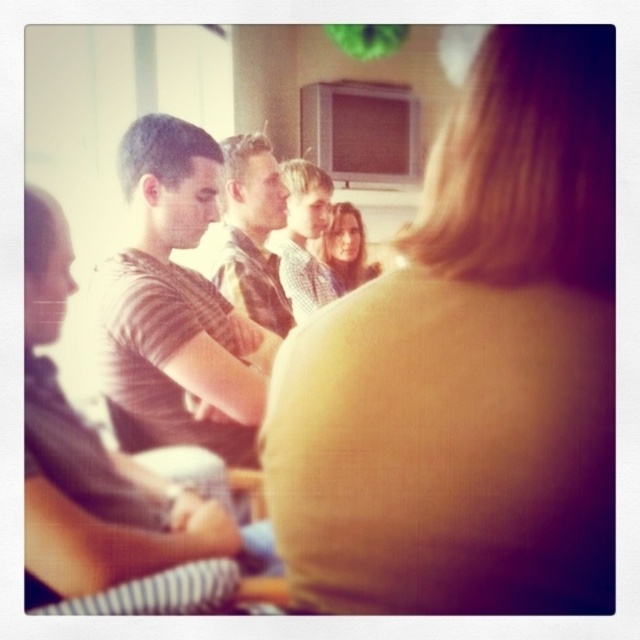
Based on the scene description, what object is located at the coordinates point (176, 307)?

The striped cotton shirt at center is located at point (176, 307).

You are a photographer at a social event. You want to take a photo of the matte yellow shirt at center and camouflage shirt at center. The camera has a minimum focus distance of 5 feet. Can you focus on both subjects clearly?

The matte yellow shirt at center is 4.98 feet away from camouflage shirt at center. Since the distance between them is less than 5 feet, the camera cannot focus on both subjects clearly.

You are at a social gathering and notice two people wearing a striped cotton shirt at center and a light brown shirt at center. Which one is closer to you?

The striped cotton shirt at center is closer to you as it is in front of the light brown shirt at center.